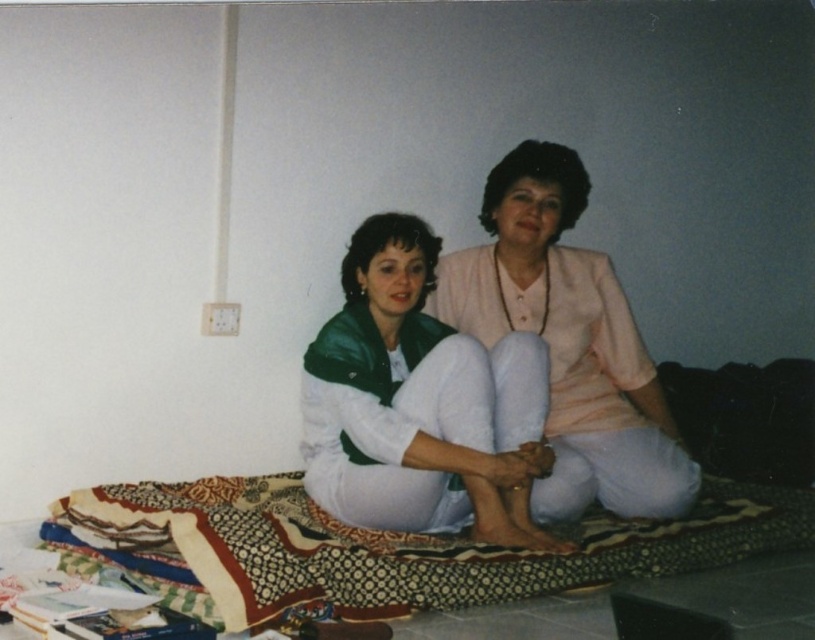
Does point (518, 435) come in front of point (659, 513)?

Yes, it is.

Is matte pink blouse at center to the left of light pink fabric at center from the viewer's perspective?

Indeed, matte pink blouse at center is positioned on the left side of light pink fabric at center.

Locate an element on the screen. This screenshot has width=815, height=640. matte pink blouse at center is located at coordinates (419, 403).

Who is positioned more to the left, patterned fabric blanket at center or matte pink blouse at center?

matte pink blouse at center is more to the left.

Does point (329, 518) come closer to viewer compared to point (439, 476)?

No, (329, 518) is further to viewer.

Where is `patterned fabric blanket at center`? patterned fabric blanket at center is located at coordinates (404, 547).

In the scene shown: Does patterned fabric blanket at center have a lesser height compared to light pink fabric at center?

Yes.

Consider the image. Is patterned fabric blanket at center taller than light pink fabric at center?

No.

What do you see at coordinates (404, 547) in the screenshot? I see `patterned fabric blanket at center` at bounding box center [404, 547].

Where is `patterned fabric blanket at center`? The width and height of the screenshot is (815, 640). patterned fabric blanket at center is located at coordinates [x=404, y=547].